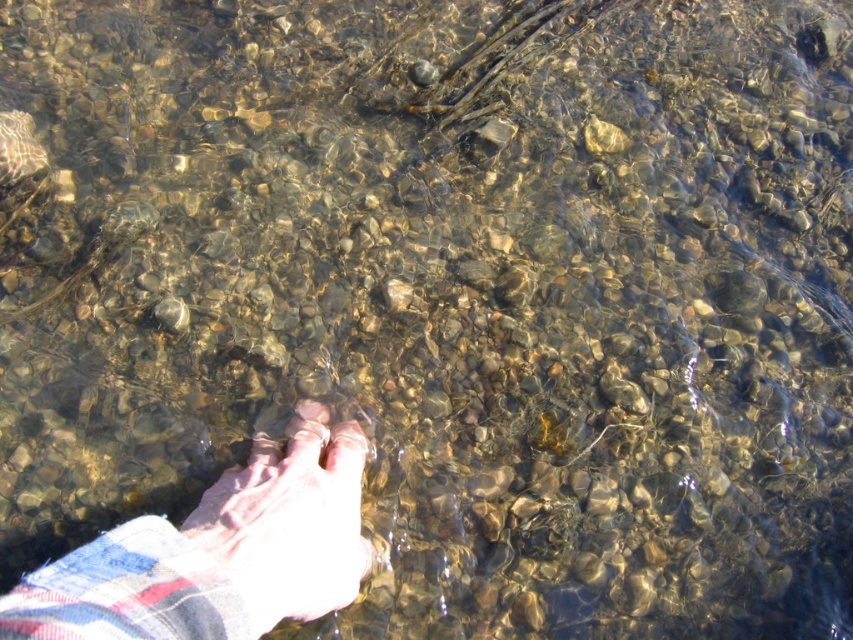
You are a photographer trying to capture the reflection of the plaid fabric hand at lower left and the pink flesh at center in the water. Which object will have its reflection closer to you in the image?

The plaid fabric hand at lower left is closer to the viewer than the pink flesh at center, so its reflection will also appear closer to you in the image.

You are standing near a shallow stream and see your pink fabric foot at center and pink flesh at center in the water. Which part of your foot is closer to the left side of the stream?

The pink fabric foot at center is positioned on the left side of pink flesh at center, so the pink fabric foot at center is closer to the left side of the stream.

You are a photographer trying to capture the reflection of the pebbles in the water. You notice a point at coordinate [212,557] on the plaid fabric hand at lower left. Is this point likely to be above or below the water surface?

The point at coordinate [212,557] is on the plaid fabric hand at lower left, which is partially submerged. Since the hand is reaching into the water, the point on the hand is likely below the water surface.